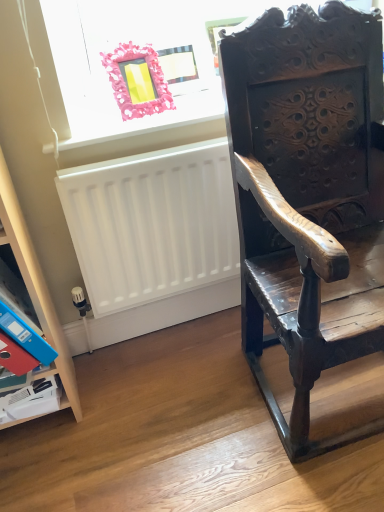
I want to click on vacant area that lies to the right of white matte radiator at lower left, so click(242, 356).